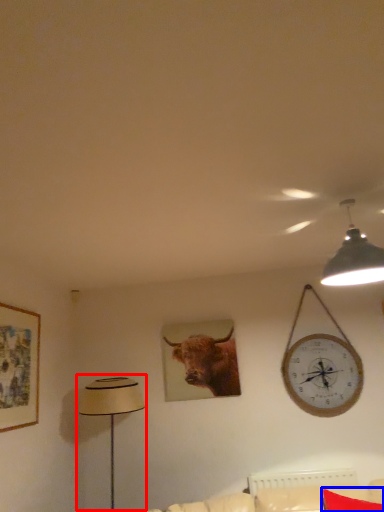
Question: Which point is further to the camera, table lamp (highlighted by a red box) or pillow (highlighted by a blue box)?

Choices:
 (A) table lamp
 (B) pillow

Answer: (A)